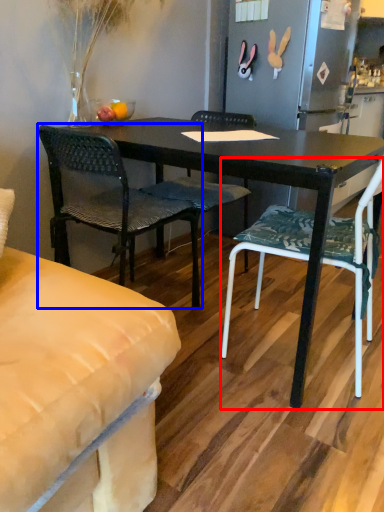
Question: Which object appears closest to the camera in this image, chair (highlighted by a red box) or chair (highlighted by a blue box)?

Choices:
 (A) chair
 (B) chair

Answer: (A)